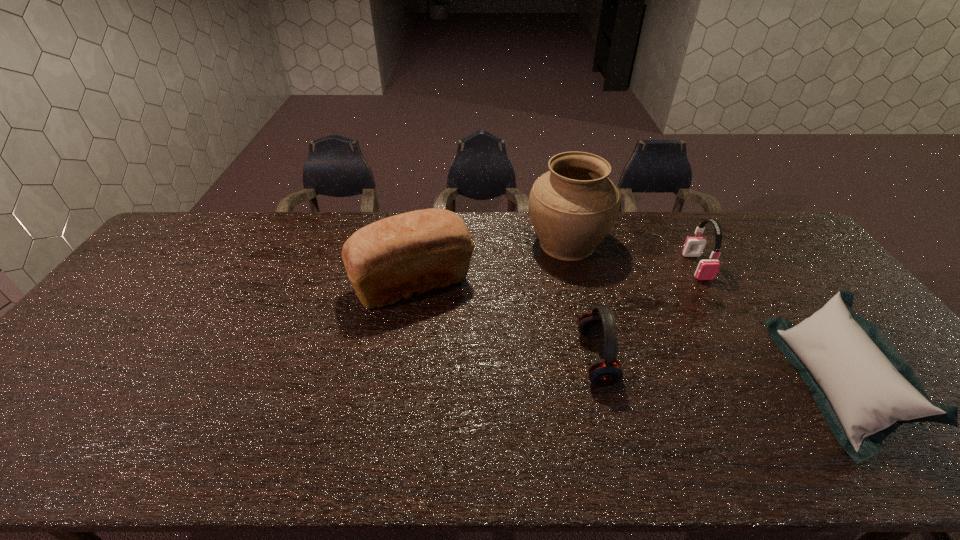
At what (x,y) coordinates should I click in order to perform the action: click on free space between the bread and the cushion. Please return your answer as a coordinate pair (x, y). The image size is (960, 540). Looking at the image, I should click on (622, 334).

This screenshot has height=540, width=960. Identify the location of vacant area that lies between the second object from right to left and the nearer earphone. pos(646,313).

Locate an element on the screen. unoccupied position between the tallest object and the rightmost object is located at coordinates (700, 314).

This screenshot has height=540, width=960. Identify the location of free point between the urn and the rightmost object. (700, 314).

Locate which object is the fourth closest to the tallest object. Please provide its 2D coordinates. Your answer should be formatted as a tuple, i.e. [(x, y)], where the tuple contains the x and y coordinates of a point satisfying the conditions above.

[(865, 389)]

Locate which object ranks third in proximity to the cushion. Please provide its 2D coordinates. Your answer should be formatted as a tuple, i.e. [(x, y)], where the tuple contains the x and y coordinates of a point satisfying the conditions above.

[(606, 372)]

This screenshot has height=540, width=960. What are the coordinates of `free space that satisfies the following two spatial constraints: 1. on the outer surface of the fourth object from left to right; 2. on the ear cups of the left earphone` in the screenshot? It's located at (748, 359).

This screenshot has height=540, width=960. I want to click on vacant space that satisfies the following two spatial constraints: 1. on the outer surface of the right earphone; 2. on the ear cups of the left earphone, so click(748, 359).

The width and height of the screenshot is (960, 540). I want to click on vacant position in the image that satisfies the following two spatial constraints: 1. on the outer surface of the fourth object from left to right; 2. on the ear cups of the left earphone, so click(x=748, y=359).